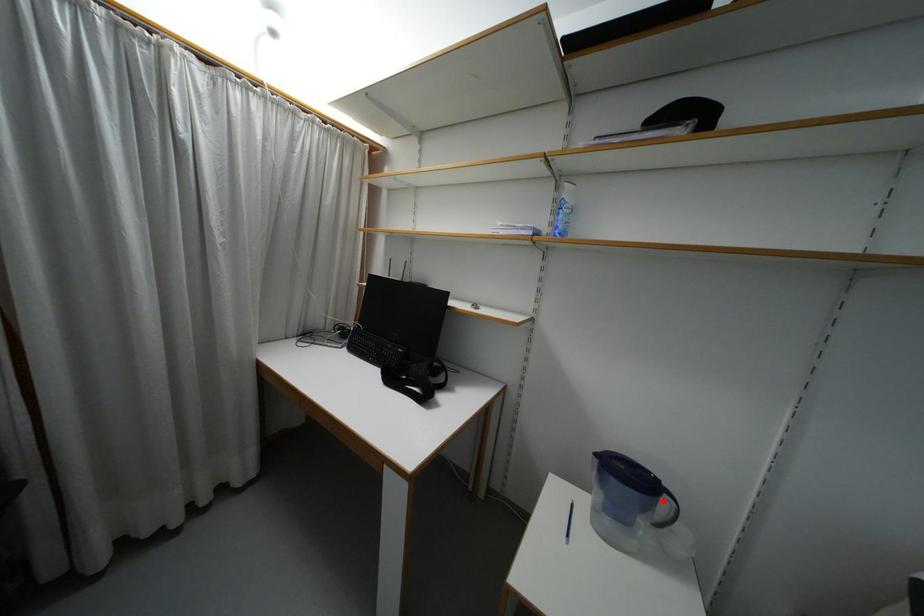
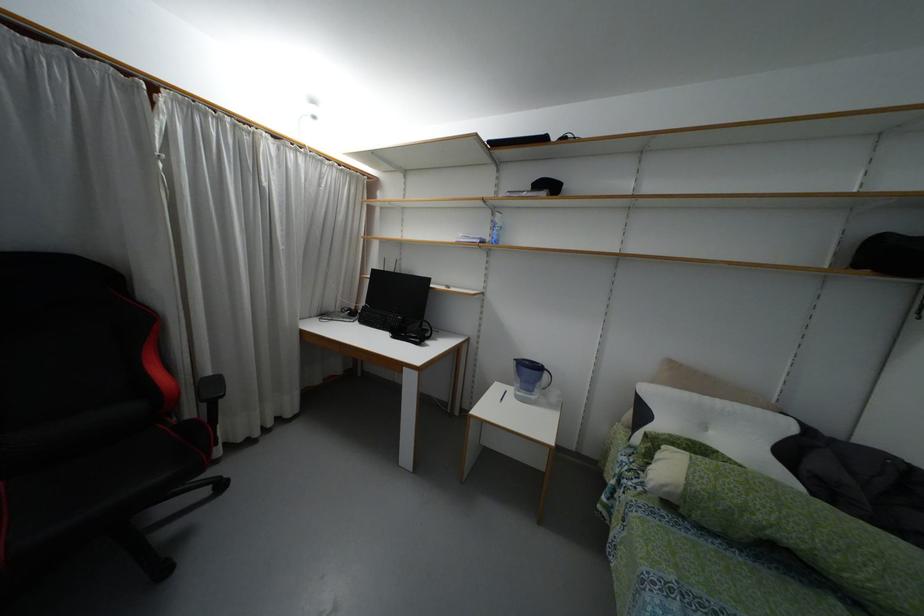
Where in the second image is the point corresponding to the highlighted location from the first image?

(544, 375)